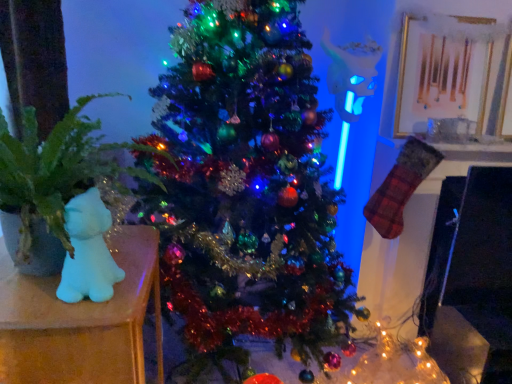
Question: Is white matte bear at left bigger or smaller than green matte plant at left?

Choices:
 (A) small
 (B) big

Answer: (A)

Question: Considering the positions of white matte bear at left and green matte plant at left in the image, is white matte bear at left wider or thinner than green matte plant at left?

Choices:
 (A) thin
 (B) wide

Answer: (A)

Question: Which object is positioned closest to the white matte plush cat at left?

Choices:
 (A) white matte bear at left
 (B) green matte plant at left
 (C) shiny green christmas tree at center

Answer: (A)

Question: Which object is the farthest from the green matte plant at left?

Choices:
 (A) shiny green christmas tree at center
 (B) white matte bear at left
 (C) white matte plush cat at left

Answer: (A)